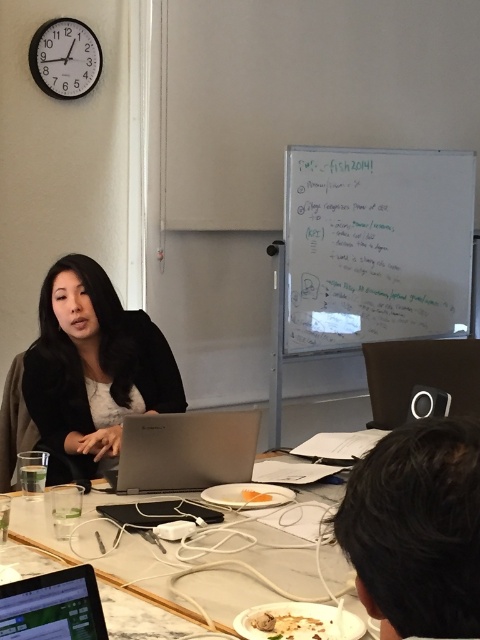
Can you confirm if matte black jacket at center is thinner than orange matte plate at center?

Incorrect, matte black jacket at center's width is not less than orange matte plate at center's.

Locate an element on the screen. matte black jacket at center is located at coordinates (93, 371).

Identify the location of matte black jacket at center. The image size is (480, 640). (93, 371).

Consider the image. Is matte black jacket at center above silver metallic laptop at center?

Yes, matte black jacket at center is above silver metallic laptop at center.

Is point (112, 314) closer to camera compared to point (156, 474)?

That is False.

Locate an element on the screen. matte black jacket at center is located at coordinates (93, 371).

Does whiteboard at upper center have a smaller size compared to orange matte plate at center?

Incorrect, whiteboard at upper center is not smaller in size than orange matte plate at center.

Is point (307, 312) behind point (271, 497)?

Yes, point (307, 312) is behind point (271, 497).

You are a GUI agent. You are given a task and a screenshot of the screen. Output one action in this format:
    pyautogui.click(x=<x>, y=<y>)
    Task: Click on the whiteboard at upper center
    The height and width of the screenshot is (640, 480).
    Given the screenshot: What is the action you would take?
    pyautogui.click(x=375, y=244)

Find the location of a particular element. The height and width of the screenshot is (640, 480). whiteboard at upper center is located at coordinates (375, 244).